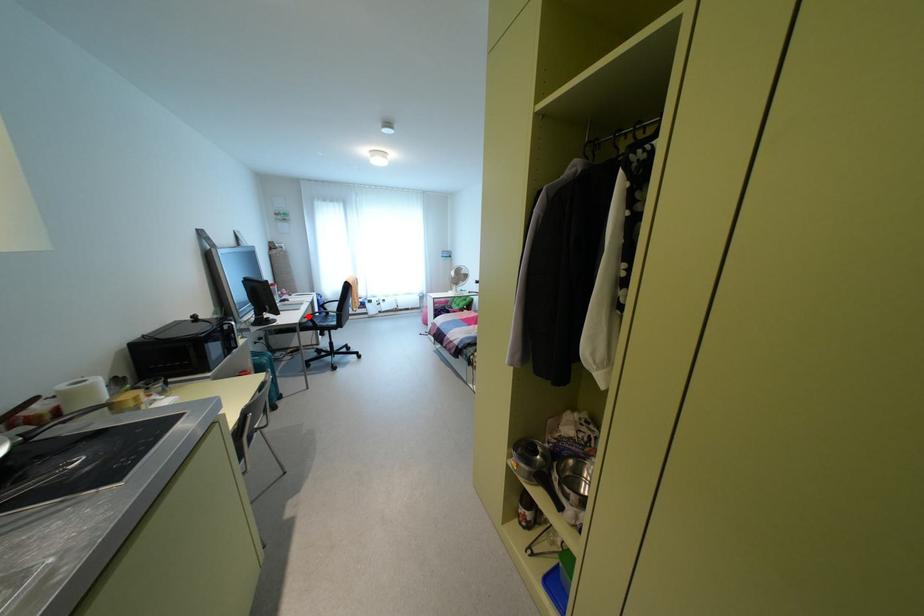
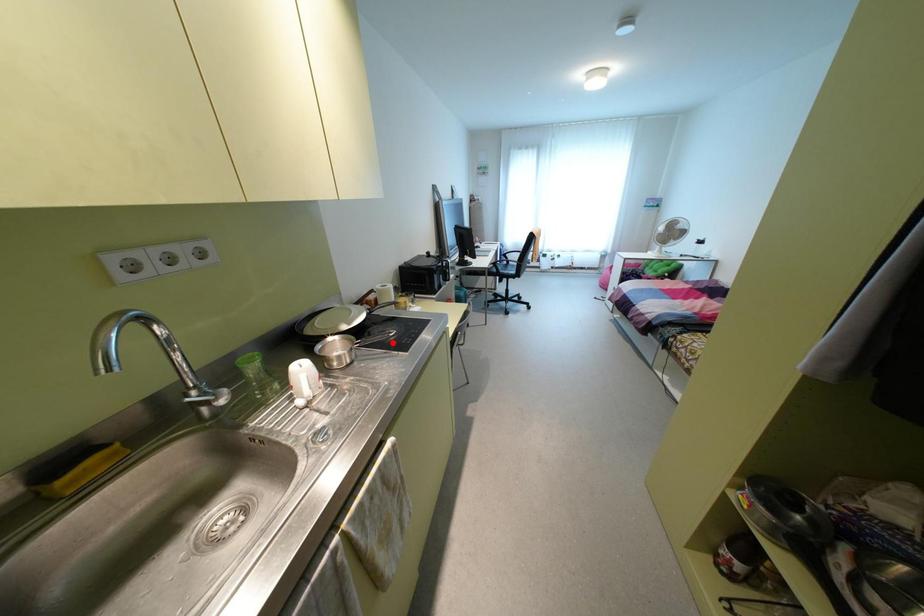
From the picture: I am providing you with two images of the same scene from different viewpoints. A red point is marked on the first image and another point is marked on the second image. Is the red point in image1 aligned with the point shown in image2?

No